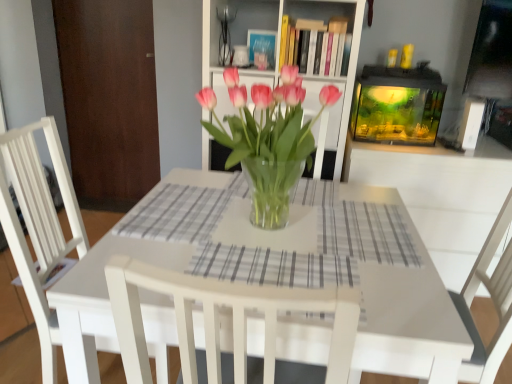
This screenshot has width=512, height=384. What do you see at coordinates (272, 267) in the screenshot? I see `gray checkered placemat at center, positioned as the 2th plaid in left-to-right order` at bounding box center [272, 267].

Identify the location of translucent glass vase at center. (268, 139).

Measure the distance between point (345, 111) and camera.

2.16 meters.

At what (x,y) coordinates should I click in order to perform the action: click on brown wood door at left. Please return your answer as a coordinate pair (x, y). This screenshot has width=512, height=384. Looking at the image, I should click on (109, 99).

What do you see at coordinates (109, 99) in the screenshot? I see `brown wood door at left` at bounding box center [109, 99].

Where is `white wood chair at center`? This screenshot has width=512, height=384. white wood chair at center is located at coordinates (39, 226).

From a real-world perspective, is transparent glass vase at center over gray checkered placemat at center, positioned as the 2th plaid in left-to-right order?

Yes, from a real-world perspective, transparent glass vase at center is above gray checkered placemat at center, positioned as the 2th plaid in left-to-right order.

Is transparent glass vase at center located outside gray checkered placemat at center, marked as the first plaid in a right-to-left arrangement?

transparent glass vase at center is positioned outside gray checkered placemat at center, marked as the first plaid in a right-to-left arrangement.

Consider the image. How far apart are transparent glass vase at center and gray checkered placemat at center, the 2th plaid in the back-to-front sequence?

transparent glass vase at center is 35.24 inches from gray checkered placemat at center, the 2th plaid in the back-to-front sequence.

Considering the relative sizes of transparent glass vase at center and gray checkered placemat at center, the 2th plaid in the back-to-front sequence, in the image provided, is transparent glass vase at center bigger than gray checkered placemat at center, the 2th plaid in the back-to-front sequence,?

Yes.

From the image's perspective, is gray checkered placemat at center, acting as the second plaid starting from the bottom, below transparent glass vase at center?

Yes, from the image's perspective, gray checkered placemat at center, acting as the second plaid starting from the bottom, is below transparent glass vase at center.

Consider the image. Is gray checkered placemat at center, placed as the 1th plaid when sorted from back to front, in contact with transparent glass vase at center?

No, gray checkered placemat at center, placed as the 1th plaid when sorted from back to front, is not beside transparent glass vase at center.

Which object is positioned more to the left, gray checkered placemat at center, the 1th plaid viewed from the left, or transparent glass vase at center?

From the viewer's perspective, gray checkered placemat at center, the 1th plaid viewed from the left, appears more on the left side.

Is gray checkered placemat at center, the 1th plaid viewed from the left, oriented away from transparent glass vase at center?

gray checkered placemat at center, the 1th plaid viewed from the left, does not have its back to transparent glass vase at center.

Considering the positions of objects translucent glass vase at center and white wood chair at center in the image provided, who is in front, translucent glass vase at center or white wood chair at center?

translucent glass vase at center is closer to the camera.

Who is smaller, translucent glass vase at center or white wood chair at center?

translucent glass vase at center.

Considering the sizes of objects translucent glass vase at center and white wood chair at center in the image provided, who is taller, translucent glass vase at center or white wood chair at center?

With more height is white wood chair at center.

Which object is wider, transparent glass vase at center or white glossy table at center?

With larger width is white glossy table at center.

Can we say transparent glass vase at center lies outside white glossy table at center?

Yes, transparent glass vase at center is located beyond the bounds of white glossy table at center.

Between point (332, 67) and point (185, 204), which one is positioned in front?

The point (185, 204) is in front.

Visually, is transparent glass vase at center positioned to the left or to the right of white glossy table at center?

transparent glass vase at center is to the right of white glossy table at center.

Which is more to the left, brown wood door at left or white glossy table at center?

From the viewer's perspective, brown wood door at left appears more on the left side.

Is brown wood door at left taller than white glossy table at center?

Correct, brown wood door at left is much taller as white glossy table at center.

From a real-world perspective, which is physically above, brown wood door at left or white glossy table at center?

brown wood door at left, from a real-world perspective.

How many degrees apart are the facing directions of brown wood door at left and white glossy table at center?

The facing directions of brown wood door at left and white glossy table at center are 1.89 degrees apart.

Is gray checkered placemat at center, placed as the first plaid when sorted from top to bottom, far away from white glossy table at center?

No.

Does gray checkered placemat at center, placed as the first plaid when sorted from top to bottom, have a greater height compared to white glossy table at center?

Incorrect, the height of gray checkered placemat at center, placed as the first plaid when sorted from top to bottom, is not larger of that of white glossy table at center.

Between point (201, 211) and point (325, 333), which one is positioned behind?

The point (201, 211) is more distant.

From the image's perspective, is gray checkered placemat at center, placed as the first plaid when sorted from top to bottom, above or below white glossy table at center?

Clearly, from the image's perspective, gray checkered placemat at center, placed as the first plaid when sorted from top to bottom, is above white glossy table at center.

Measure the distance between white glossy table at center and translucent glass vase at center.

A distance of 32.27 centimeters exists between white glossy table at center and translucent glass vase at center.

From the picture: Can you confirm if white glossy table at center is thinner than translucent glass vase at center?

No.

From the image's perspective, does white glossy table at center appear higher than translucent glass vase at center?

Incorrect, from the image's perspective, white glossy table at center is lower than translucent glass vase at center.

Does point (83, 323) come closer to viewer compared to point (239, 143)?

Yes, point (83, 323) is in front of point (239, 143).

This screenshot has height=384, width=512. Find the location of `shelf lying above the gray checkered placemat at center, which is the 1th plaid in bottom-to-top order (from the image's perspective)`. shelf lying above the gray checkered placemat at center, which is the 1th plaid in bottom-to-top order (from the image's perspective) is located at coordinates (328, 72).

Find the location of a particular element. shelf that appears above the gray checkered placemat at center, placed as the 1th plaid when sorted from back to front (from a real-world perspective) is located at coordinates 328,72.

Which object lies further to the anchor point transparent glass vase at center, white wood chair at center or translucent glass vase at center?

The object further to transparent glass vase at center is white wood chair at center.

Considering their positions, is gray checkered placemat at center, placed as the 1th plaid when sorted from back to front, positioned closer to gray checkered placemat at center, acting as the 2th plaid starting from the top, than brown wood door at left?

Among the two, gray checkered placemat at center, placed as the 1th plaid when sorted from back to front, is located nearer to gray checkered placemat at center, acting as the 2th plaid starting from the top.

Which object lies further to the anchor point gray checkered placemat at center, the 1th plaid viewed from the left, transparent glass vase at center or white glossy table at center?

transparent glass vase at center is further to gray checkered placemat at center, the 1th plaid viewed from the left.

Consider the image. From the image, which object appears to be farther from gray checkered placemat at center, placed as the 1th plaid when sorted from back to front, transparent glass vase at center or brown wood door at left?

Among the two, brown wood door at left is located further to gray checkered placemat at center, placed as the 1th plaid when sorted from back to front.

From the picture: From the image, which object appears to be farther from translucent glass vase at center, gray checkered placemat at center, positioned as the 2th plaid in left-to-right order, or white glossy table at center?

Based on the image, white glossy table at center appears to be further to translucent glass vase at center.

From the image, which object appears to be nearer to gray checkered placemat at center, the 1th plaid viewed from the left, gray checkered placemat at center, positioned as the 2th plaid in left-to-right order, or brown wood door at left?

Based on the image, gray checkered placemat at center, positioned as the 2th plaid in left-to-right order, appears to be nearer to gray checkered placemat at center, the 1th plaid viewed from the left.

When comparing their distances from brown wood door at left, does white wood chair at center or transparent glass vase at center seem further?

Based on the image, white wood chair at center appears to be further to brown wood door at left.

When comparing their distances from brown wood door at left, does gray checkered placemat at center, acting as the 2th plaid starting from the top, or translucent glass vase at center seem further?

Based on the image, gray checkered placemat at center, acting as the 2th plaid starting from the top, appears to be further to brown wood door at left.

Locate an element on the screen. This screenshot has width=512, height=384. shelf between gray checkered placemat at center, arranged as the 2th plaid when viewed from the right, and brown wood door at left, along the z-axis is located at coordinates (328, 72).

Locate an element on the screen. This screenshot has height=384, width=512. shelf between translucent glass vase at center and brown wood door at left along the z-axis is located at coordinates (328, 72).

Locate an element on the screen. The image size is (512, 384). houseplant located between white glossy table at center and transparent glass vase at center in the depth direction is located at coordinates (268, 139).

Locate an element on the screen. Image resolution: width=512 pixels, height=384 pixels. table situated between white wood chair at center and translucent glass vase at center from left to right is located at coordinates (398, 298).